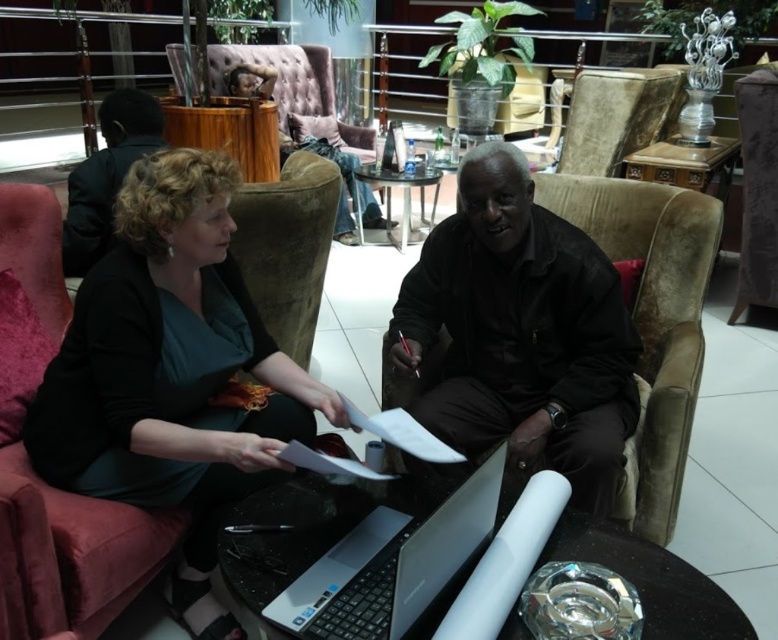
Question: Which object is closer to the camera taking this photo?

Choices:
 (A) dark brown leather jacket at upper left
 (B) black leather jacket at center

Answer: (B)

Question: Does black leather jacket at center lie behind silver metallic laptop at center?

Choices:
 (A) no
 (B) yes

Answer: (B)

Question: Is matte black jacket at center positioned behind black leather jacket at center?

Choices:
 (A) no
 (B) yes

Answer: (A)

Question: Which object is the farthest from the matte black jacket at center?

Choices:
 (A) black leather jacket at center
 (B) silver metallic laptop at center
 (C) dark brown leather jacket at upper left

Answer: (C)

Question: Can you confirm if matte black jacket at center is positioned below black leather jacket at center?

Choices:
 (A) no
 (B) yes

Answer: (B)

Question: Among these points, which one is nearest to the camera?

Choices:
 (A) (131, 186)
 (B) (605, 317)

Answer: (A)